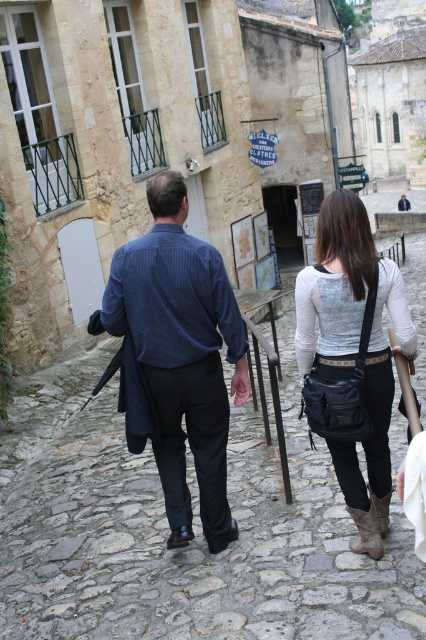
Question: Which object is positioned farthest from the matte black bag at center?

Choices:
 (A) dark blue shirt at center
 (B) blue striped shirt at center

Answer: (A)

Question: Which point is farther from the camera taking this photo?

Choices:
 (A) (178, 387)
 (B) (356, 502)

Answer: (A)

Question: Can you confirm if dark blue shirt at center is smaller than blue striped shirt at center?

Choices:
 (A) no
 (B) yes

Answer: (A)

Question: Is blue striped shirt at center thinner than matte black bag at center?

Choices:
 (A) yes
 (B) no

Answer: (A)

Question: Which of the following is the farthest from the observer?

Choices:
 (A) dark blue shirt at center
 (B) blue striped shirt at center

Answer: (B)

Question: Can you confirm if dark blue shirt at center is smaller than blue striped shirt at center?

Choices:
 (A) no
 (B) yes

Answer: (A)